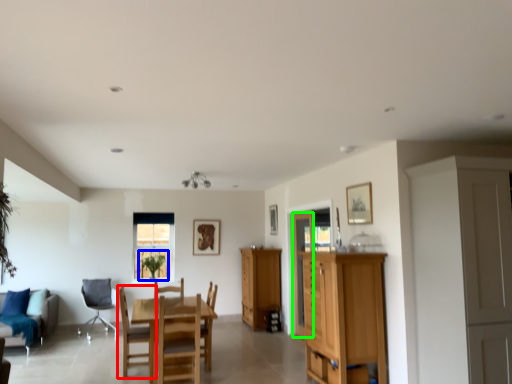
Question: Which object is positioned closest to chair (highlighted by a red box)? Select from plant (highlighted by a blue box) and glass door (highlighted by a green box).

Choices:
 (A) plant
 (B) glass door

Answer: (A)